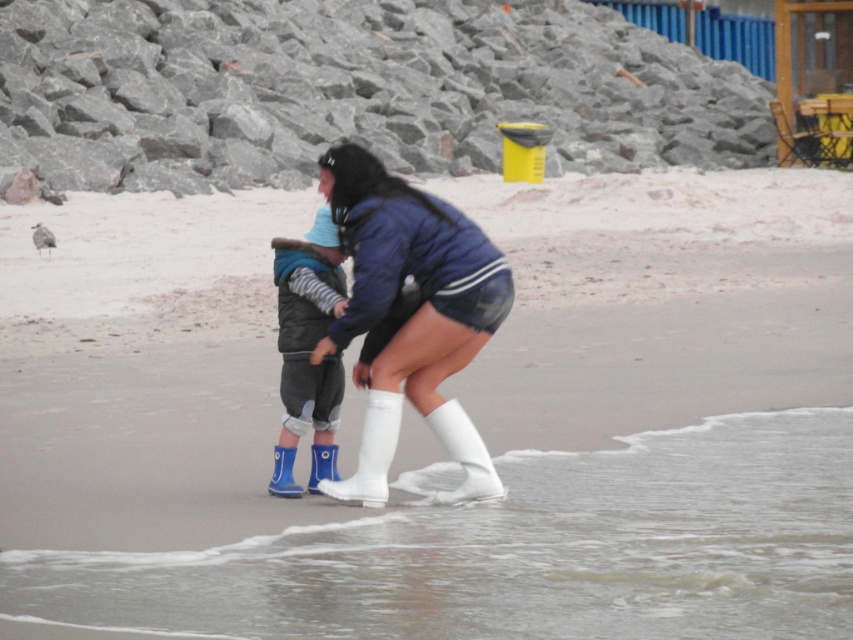
Question: Considering the real-world distances, which object is farthest from the gray rock at upper center?

Choices:
 (A) white matte socks at lower center
 (B) white rubber boots at lower center
 (C) rubber blue rain boot at lower center

Answer: (B)

Question: Can you confirm if gray rock at upper center is thinner than blue rubber boots at center?

Choices:
 (A) yes
 (B) no

Answer: (B)

Question: Is smooth sand at lower center smaller than rubber blue rain boot at lower center?

Choices:
 (A) yes
 (B) no

Answer: (B)

Question: Which object is positioned farthest from the white rubber rain boot at center?

Choices:
 (A) white matte socks at lower center
 (B) clear water at lower center
 (C) white rubber boots at lower center
 (D) blue rubber rain boot at lower center

Answer: (B)

Question: Which object appears closest to the camera in this image?

Choices:
 (A) blue rubber boots at center
 (B) gray rock at upper center
 (C) white rubber boots at lower center
 (D) smooth sand at lower center

Answer: (D)

Question: Observing the image, what is the correct spatial positioning of white rubber rain boot at center in reference to white matte socks at lower center?

Choices:
 (A) left
 (B) right

Answer: (A)